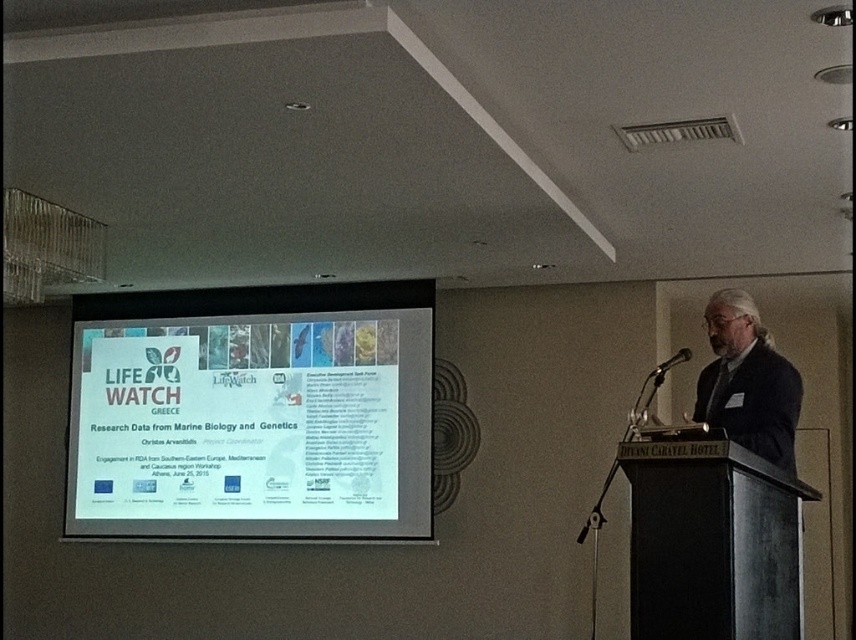
You are an attendee at the presentation and need to place both the white paper at center and the black plastic microphone at center on a table that can only accommodate one of them. Based on their sizes, which object should you prioritize placing first?

The white paper at center is wider than the black plastic microphone at center, so you should prioritize placing the white paper at center first to ensure it fits on the table.

From the picture: You are an attendee sitting in the front row of the conference room. You notice both the gray hair at center and the black plastic microphone at center. Which object is closer to you?

The gray hair at center is closer to the viewer than the black plastic microphone at center, so the gray hair at center is closer to you.